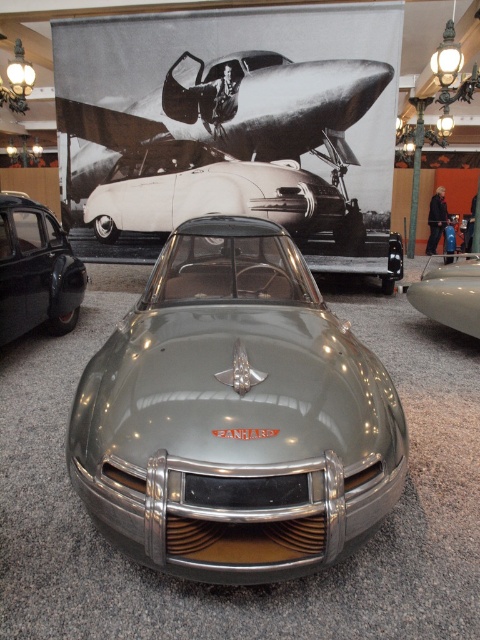
Question: Considering the real-world distances, which object is closest to the satin silver car at center?

Choices:
 (A) metallic silver sports car at center
 (B) shiny silver airplane at upper center
 (C) matte black car at lower left

Answer: (A)

Question: Is shiny silver airplane at upper center above matte black car at lower left?

Choices:
 (A) yes
 (B) no

Answer: (A)

Question: Which point is farther to the camera?

Choices:
 (A) (352, 248)
 (B) (232, 106)
 (C) (431, 317)
 (D) (275, 467)

Answer: (A)

Question: Which is farther from the satin silver concept car at center?

Choices:
 (A) matte black car at lower left
 (B) satin silver car at center

Answer: (B)

Question: Can you confirm if satin silver concept car at center is positioned to the left of satin silver car at center?

Choices:
 (A) yes
 (B) no

Answer: (A)

Question: Does satin silver concept car at center lie behind metallic silver sports car at center?

Choices:
 (A) no
 (B) yes

Answer: (A)